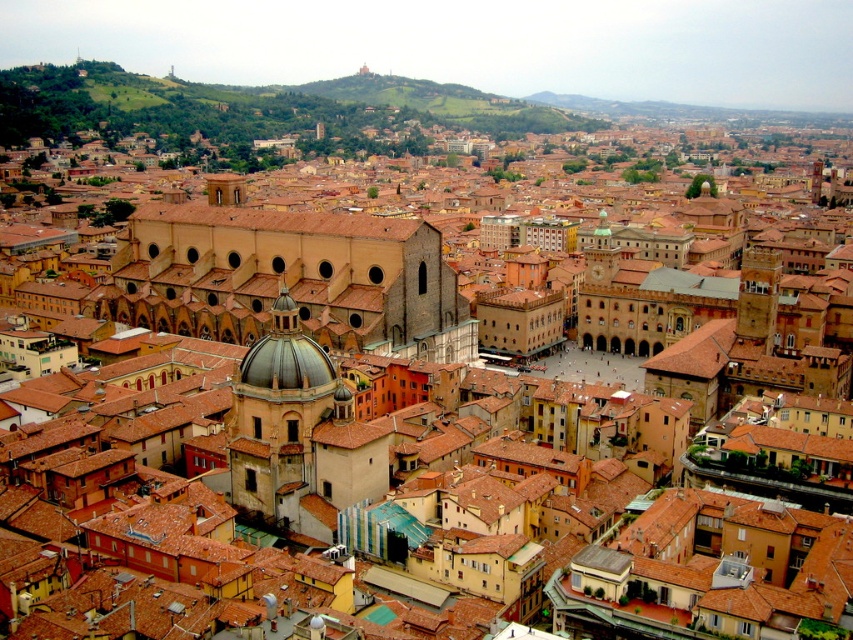
Based on the photo, who is higher up, metallic dome at center or brown tile roof at center?

Positioned higher is brown tile roof at center.

Image resolution: width=853 pixels, height=640 pixels. Describe the element at coordinates (280, 417) in the screenshot. I see `metallic dome at center` at that location.

The width and height of the screenshot is (853, 640). In order to click on metallic dome at center in this screenshot , I will do `click(280, 417)`.

Locate an element on the screen. metallic dome at center is located at coordinates (280, 417).